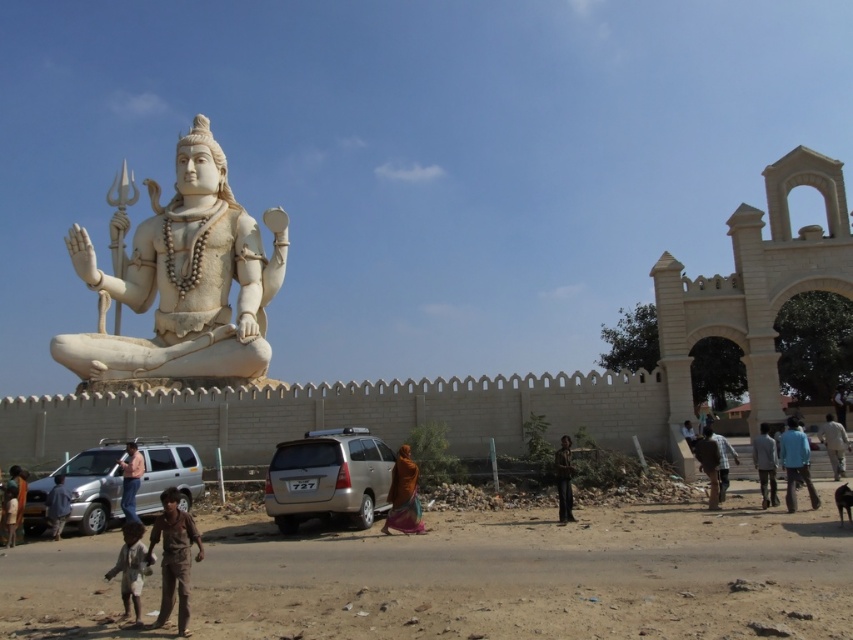
You are a photographer trying to capture the statue and the people in the scene. You notice the blue cotton shirt at lower right and the brown fabric shirt at center. Which person is standing more to the right side of the statue?

The blue cotton shirt at lower right is positioned on the right side of brown fabric shirt at center, so the person wearing the blue cotton shirt at lower right is standing more to the right side of the statue.

You are a photographer trying to capture the statue and the people around it. You notice the brown fabric pants at lower center and the orange fabric at center. Which of these two items is taller in the photo?

The brown fabric pants at lower center is taller than the orange fabric at center according to the description.